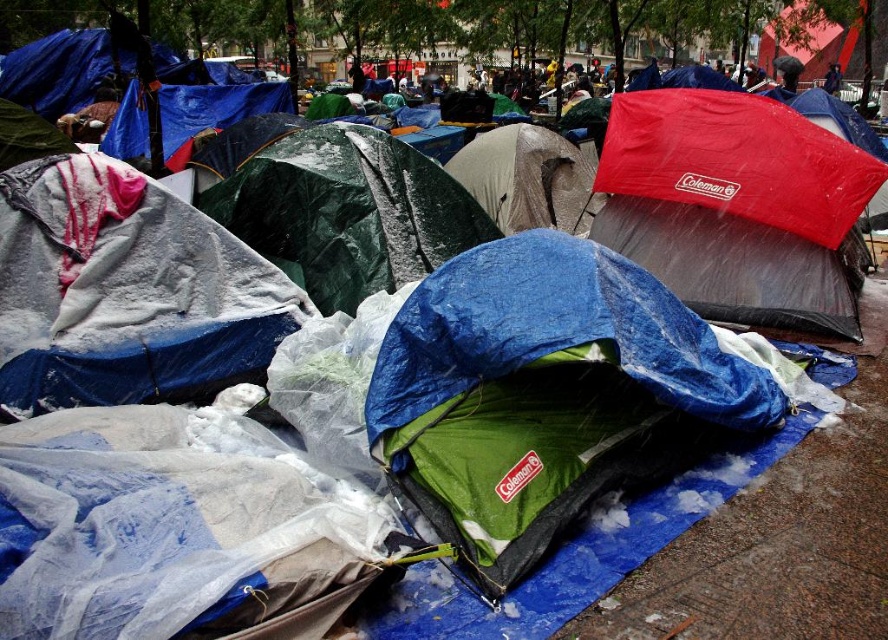
Can you confirm if red waterproof tent at upper right is positioned to the left of green tarp at center?

Incorrect, red waterproof tent at upper right is not on the left side of green tarp at center.

The height and width of the screenshot is (640, 888). Find the location of `red waterproof tent at upper right`. red waterproof tent at upper right is located at coordinates (736, 205).

Where is `red waterproof tent at upper right`? red waterproof tent at upper right is located at coordinates tap(736, 205).

Is blue tarpaulin tent at center further to the viewer compared to green tarp at center?

No, it is not.

In the scene shown: Who is more forward, (x=607, y=301) or (x=287, y=220)?

Point (x=607, y=301)

The width and height of the screenshot is (888, 640). Find the location of `blue tarpaulin tent at center`. blue tarpaulin tent at center is located at coordinates (546, 394).

Can you confirm if blue tarpaulin tent at center is wider than red waterproof tent at upper right?

Incorrect, blue tarpaulin tent at center's width does not surpass red waterproof tent at upper right's.

Who is taller, blue tarpaulin tent at center or red waterproof tent at upper right?

Standing taller between the two is red waterproof tent at upper right.

Is point (488, 428) more distant than point (678, 157)?

No.

Locate an element on the screen. blue tarpaulin tent at center is located at coordinates (546, 394).